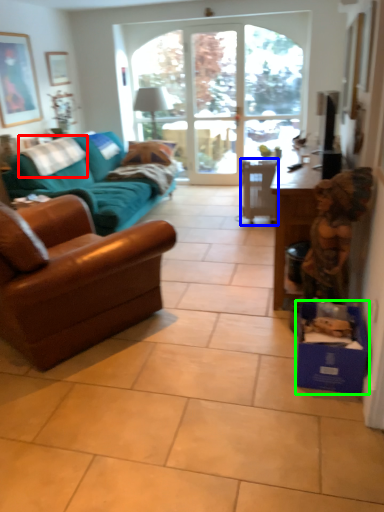
Question: Estimate the real-world distances between objects in this image. Which object is closer to pillow (highlighted by a red box), chair (highlighted by a blue box) or cardboard box (highlighted by a green box)?

Choices:
 (A) chair
 (B) cardboard box

Answer: (A)